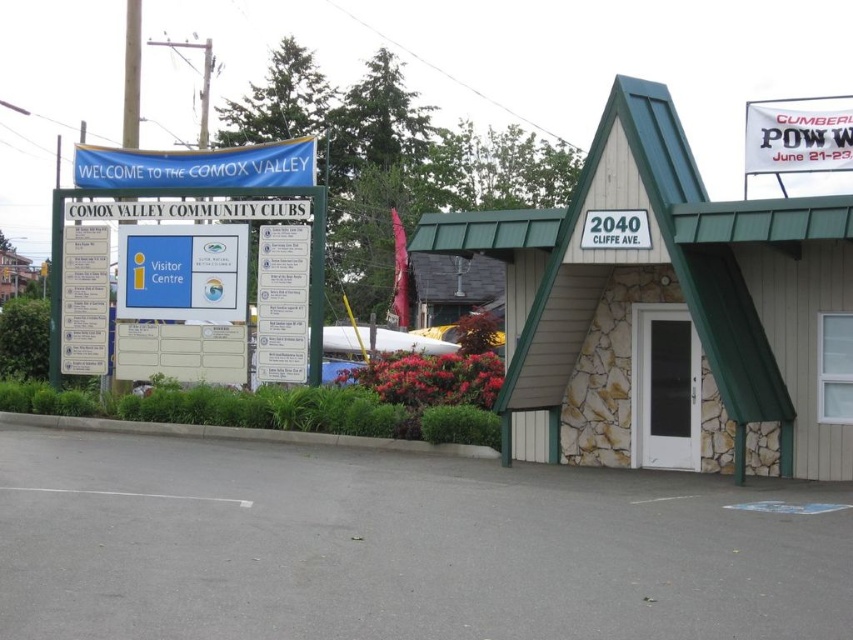
Question: Among these points, which one is farthest from the camera?

Choices:
 (A) (793, 440)
 (B) (822, 125)
 (C) (589, 243)
 (D) (105, 352)

Answer: (D)

Question: Is white paper banner at upper right bigger than white paper sign at left?

Choices:
 (A) yes
 (B) no

Answer: (A)

Question: In this image, where is white paper sign at center located relative to white plastic sign at center?

Choices:
 (A) left
 (B) right

Answer: (A)

Question: Considering the real-world distances, which object is farthest from the blue plastic sign at upper left?

Choices:
 (A) white plastic sign at center
 (B) white paper sign at center

Answer: (A)

Question: Among these objects, which one is nearest to the camera?

Choices:
 (A) blue fabric banner at upper left
 (B) white plastic sign at center
 (C) white paper sign at center
 (D) beige siding motel at center

Answer: (B)

Question: Is blue fabric banner at upper left to the left of white paper banner at upper right from the viewer's perspective?

Choices:
 (A) yes
 (B) no

Answer: (A)